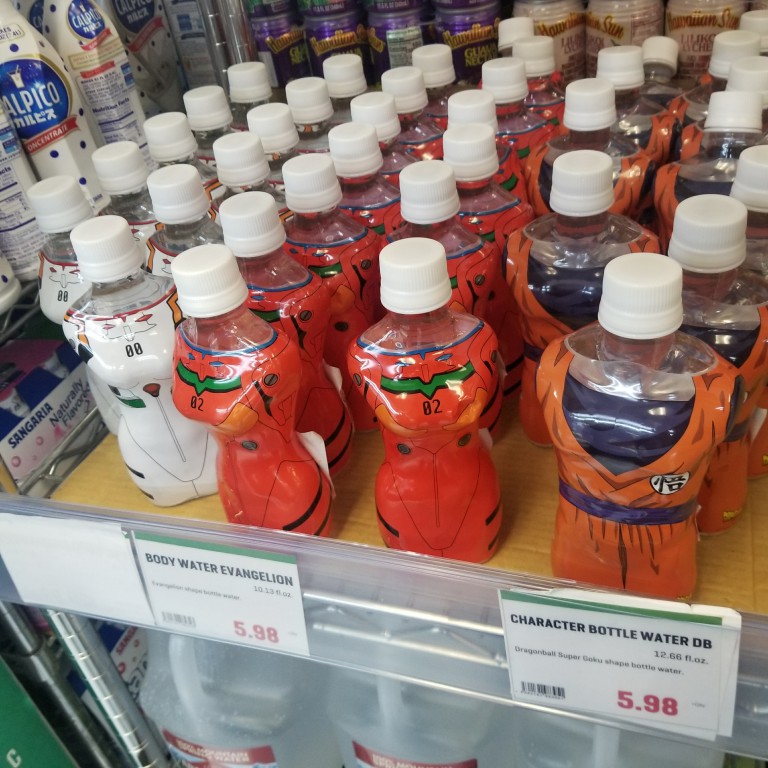
Locate an element on the screen. shelves is located at coordinates (362, 617).